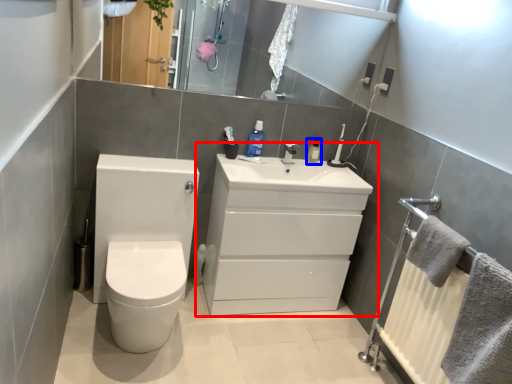
Question: Which object appears closest to the camera in this image, bathroom cabinet (highlighted by a red box) or mouthwash (highlighted by a blue box)?

Choices:
 (A) bathroom cabinet
 (B) mouthwash

Answer: (A)